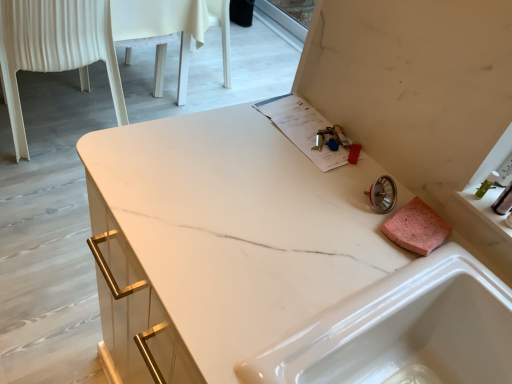
This screenshot has width=512, height=384. Describe the element at coordinates (55, 50) in the screenshot. I see `white plastic chair at left` at that location.

What is the approximate height of translucent plastic container at right?

5.25 inches.

You are a GUI agent. You are given a task and a screenshot of the screen. Output one action in this format:
    pyautogui.click(x=<x>, y=<y>)
    Task: Click on the white plastic chair at left
    The image size is (512, 384).
    Given the screenshot: What is the action you would take?
    pyautogui.click(x=55, y=50)

Is white plastic chair at left wider or thinner than white glossy sink at lower right?

Considering their sizes, white plastic chair at left looks broader than white glossy sink at lower right.

Considering the relative positions of white plastic chair at left and white glossy sink at lower right in the image provided, is white plastic chair at left to the left of white glossy sink at lower right from the viewer's perspective?

Yes, white plastic chair at left is to the left of white glossy sink at lower right.

Considering the sizes of objects white plastic chair at left and white glossy sink at lower right in the image provided, who is taller, white plastic chair at left or white glossy sink at lower right?

Standing taller between the two is white plastic chair at left.

Locate an element on the screen. This screenshot has height=384, width=512. toiletry that appears above the white glossy sink at lower right (from the image's perspective) is located at coordinates (503, 201).

In the scene shown: Is white glossy sink at lower right completely or partially outside of translucent plastic container at right?

Absolutely, white glossy sink at lower right is external to translucent plastic container at right.

Between white glossy sink at lower right and translucent plastic container at right, which one has more height?

Standing taller between the two is white glossy sink at lower right.

Which is nearer, (x=479, y=311) or (x=507, y=211)?

Point (x=479, y=311) appears to be closer to the viewer than point (x=507, y=211).

From their relative heights in the image, would you say translucent plastic container at right is taller or shorter than white glossy sink at lower right?

translucent plastic container at right is shorter than white glossy sink at lower right.

Choose the correct answer: Is translucent plastic container at right inside white glossy sink at lower right or outside it?

translucent plastic container at right lies outside white glossy sink at lower right.

What are the coordinates of `sink below the translucent plastic container at right (from a real-world perspective)` in the screenshot? It's located at (402, 330).

Is translucent plastic container at right bigger than white glossy sink at lower right?

Incorrect, translucent plastic container at right is not larger than white glossy sink at lower right.

From the image's perspective, is translucent plastic container at right located beneath white plastic chair at left?

Indeed, from the image's perspective, translucent plastic container at right is shown beneath white plastic chair at left.

Is translucent plastic container at right positioned before white plastic chair at left?

Yes, translucent plastic container at right is closer to the viewer.

Is translucent plastic container at right facing towards white plastic chair at left?

No, translucent plastic container at right is not oriented towards white plastic chair at left.

Can you confirm if white plastic chair at left is wider than translucent plastic container at right?

Correct, the width of white plastic chair at left exceeds that of translucent plastic container at right.

Considering the relative sizes of white plastic chair at left and translucent plastic container at right in the image provided, is white plastic chair at left taller than translucent plastic container at right?

Yes, white plastic chair at left is taller than translucent plastic container at right.

Find the location of a particular element. The height and width of the screenshot is (384, 512). toiletry above the white plastic chair at left (from a real-world perspective) is located at coordinates tap(503, 201).

From a real-world perspective, is white plastic chair at left above or below translucent plastic container at right?

white plastic chair at left is situated lower than translucent plastic container at right in the real world.

From a real-world perspective, relative to white plastic chair at left, is white glossy sink at lower right vertically above or below?

white glossy sink at lower right is above white plastic chair at left.

Is white glossy sink at lower right facing away from white plastic chair at left?

No, white glossy sink at lower right's orientation is not away from white plastic chair at left.

Is white glossy sink at lower right in contact with white plastic chair at left?

No, white glossy sink at lower right is not with white plastic chair at left.

Which point is more forward, (331,369) or (69,55)?

The point (331,369) is closer to the camera.

At what (x,y) coordinates should I click in order to perform the action: click on chair located above the white glossy sink at lower right (from the image's perspective). Please return your answer as a coordinate pair (x, y). The height and width of the screenshot is (384, 512). Looking at the image, I should click on (55, 50).

At what (x,y) coordinates should I click in order to perform the action: click on sink that is under the translucent plastic container at right (from a real-world perspective). Please return your answer as a coordinate pair (x, y). The width and height of the screenshot is (512, 384). Looking at the image, I should click on (402, 330).

Considering their positions, is white glossy sink at lower right positioned further to white plastic chair at left than translucent plastic container at right?

translucent plastic container at right lies further to white plastic chair at left than the other object.

Considering their positions, is white glossy sink at lower right positioned further to translucent plastic container at right than white plastic chair at left?

white plastic chair at left is positioned further to the anchor translucent plastic container at right.

From the image, which object appears to be farther from white glossy sink at lower right, white plastic chair at left or translucent plastic container at right?

white plastic chair at left lies further to white glossy sink at lower right than the other object.

Estimate the real-world distances between objects in this image. Which object is closer to translucent plastic container at right, white plastic chair at left or white glossy sink at lower right?

Based on the image, white glossy sink at lower right appears to be nearer to translucent plastic container at right.

Which object lies further to the anchor point white plastic chair at left, translucent plastic container at right or white glossy sink at lower right?

Among the two, translucent plastic container at right is located further to white plastic chair at left.

Based on their spatial positions, is translucent plastic container at right or white plastic chair at left further from white glossy sink at lower right?

white plastic chair at left lies further to white glossy sink at lower right than the other object.

Where is `sink between white plastic chair at left and translucent plastic container at right from left to right`? sink between white plastic chair at left and translucent plastic container at right from left to right is located at coordinates (402, 330).